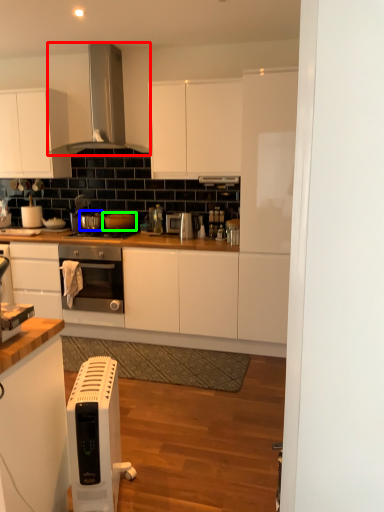
Question: Considering the real-world distances, which object is farthest from kitchen appliance (highlighted by a red box)? appliance (highlighted by a blue box) or appliance (highlighted by a green box)?

Choices:
 (A) appliance
 (B) appliance

Answer: (A)